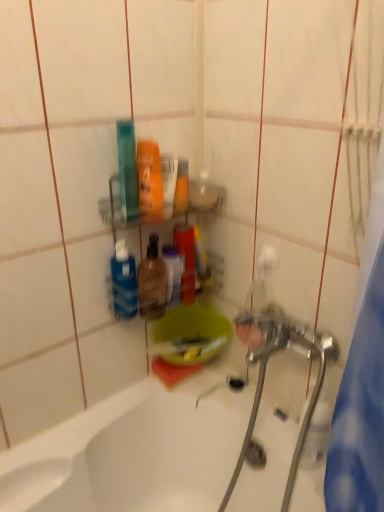
Where is `free space behind metallic silver water pipe at lower right`? Image resolution: width=384 pixels, height=512 pixels. free space behind metallic silver water pipe at lower right is located at coordinates (269, 422).